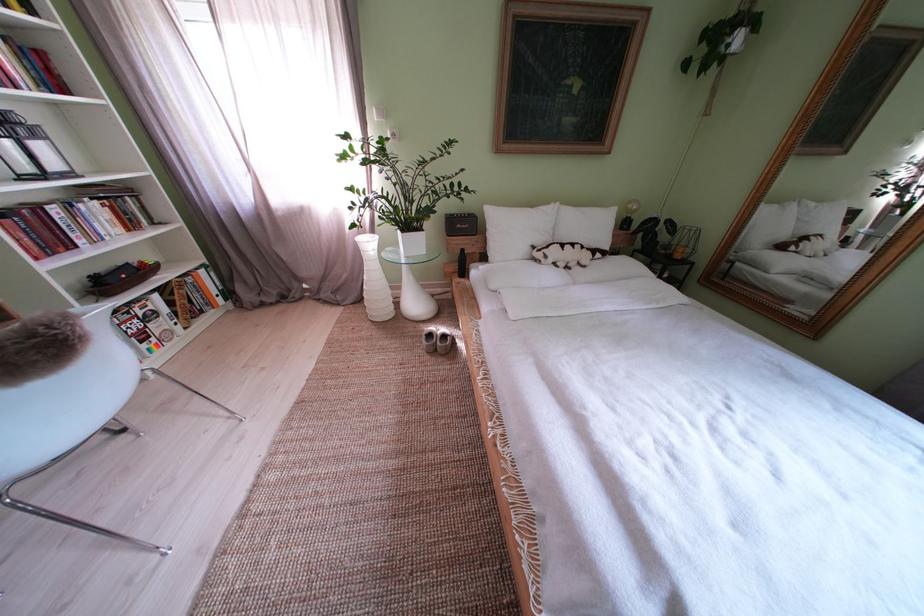
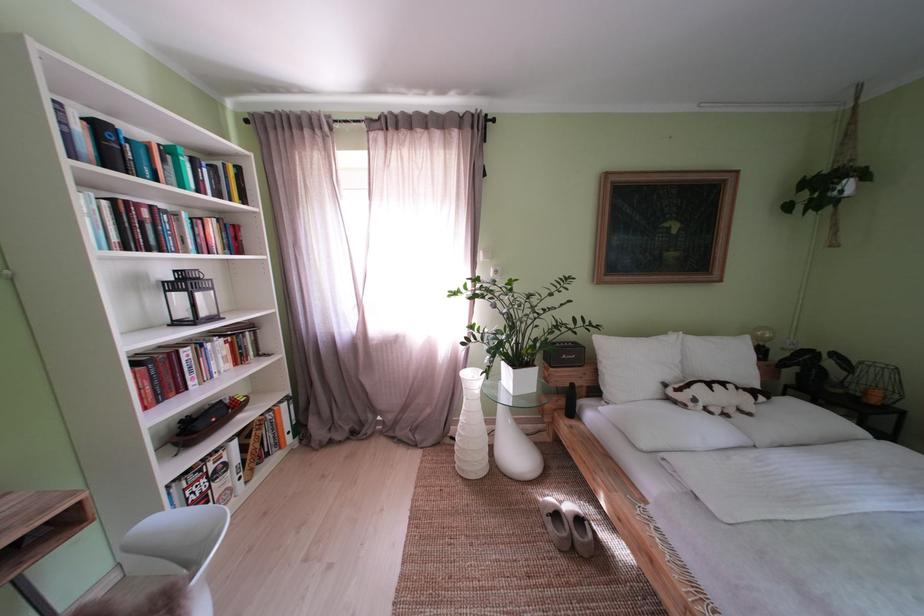
The point at (520,237) is marked in the first image. Where is the corresponding point in the second image?

(639, 369)